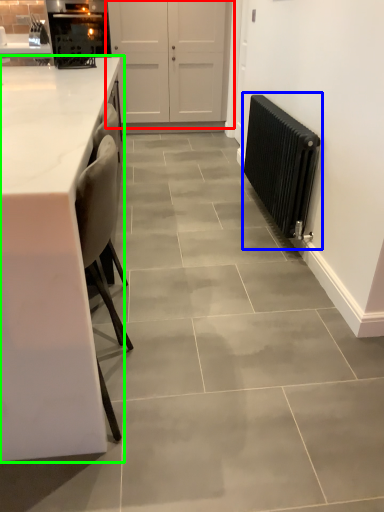
Question: Considering the real-world distances, which object is farthest from door (highlighted by a red box)? radiator (highlighted by a blue box) or countertop (highlighted by a green box)?

Choices:
 (A) radiator
 (B) countertop

Answer: (B)